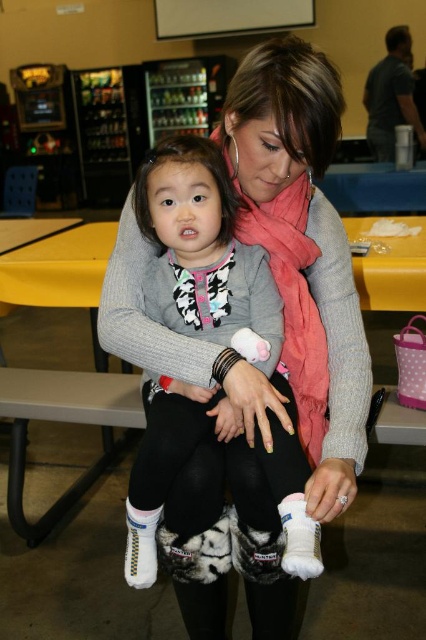
You are standing at the origin of the coordinate system in the image. There are two points marked in the scene. The first point is at position point [250,323] and the second is at point [132,580]. Which point is closer to you?

Point [250,323] is in front of point [132,580], so it is closer to you.

You are a photographer standing at a distance of 1 meter from the gray wool sweater at center. Can you take a clear photo of it without moving closer?

The gray wool sweater at center is 90.09 centimeters away from viewer, which is less than 1 meter. Therefore, you can take a clear photo of it without moving closer.